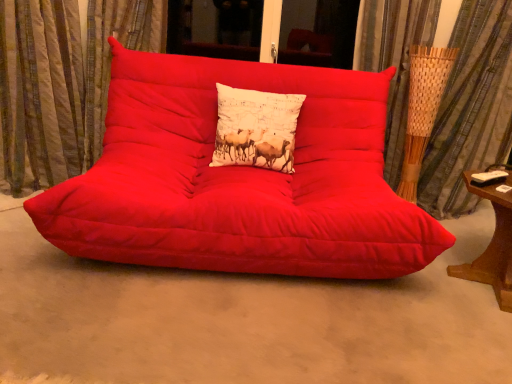
Question: Based on their sizes in the image, would you say white cotton cushion at center is bigger or smaller than matte red studio couch at center?

Choices:
 (A) big
 (B) small

Answer: (B)

Question: In the image, is white cotton cushion at center positioned in front of or behind matte red studio couch at center?

Choices:
 (A) behind
 (B) front

Answer: (A)

Question: Considering the real-world distances, which object is farthest from the white cotton cushion at center?

Choices:
 (A) textured beige curtain at left, marked as the second curtain in a right-to-left arrangement
 (B) matte red futon at center
 (C) wooden side table at right
 (D) woven bamboo curtain at right, the 1th curtain viewed from the right
 (E) matte red studio couch at center

Answer: (C)

Question: Estimate the real-world distances between objects in this image. Which object is closer to the matte red studio couch at center?

Choices:
 (A) matte red futon at center
 (B) white cotton cushion at center
 (C) wooden side table at right
 (D) textured beige curtain at left, which ranks as the 1th curtain in left-to-right order
 (E) woven bamboo curtain at right, the second curtain when ordered from left to right

Answer: (B)